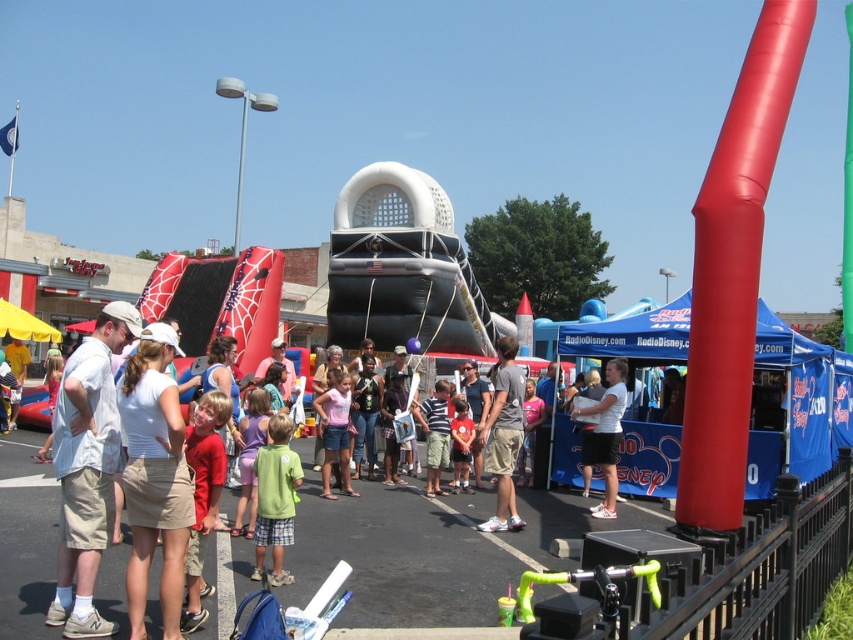
Consider the image. Is white cotton shirt at left shorter than red shirt at center?

In fact, white cotton shirt at left may be taller than red shirt at center.

Between point (90, 634) and point (473, 436), which one is positioned in front?

Positioned in front is point (90, 634).

Find the location of `white cotton shirt at left`. white cotton shirt at left is located at coordinates (86, 468).

Is green matte shirt at center positioned before red shirt at center?

Yes, it is.

Which of these two, green matte shirt at center or red shirt at center, stands taller?

green matte shirt at center

What do you see at coordinates (276, 499) in the screenshot? I see `green matte shirt at center` at bounding box center [276, 499].

Locate an element on the screen. green matte shirt at center is located at coordinates (276, 499).

Does white matte shirt at center appear on the right side of red shirt at center?

Correct, you'll find white matte shirt at center to the right of red shirt at center.

Which of these two, white matte shirt at center or red shirt at center, stands shorter?

red shirt at center

Identify the location of white matte shirt at center. The width and height of the screenshot is (853, 640). (605, 435).

Find the location of a particular element. white matte shirt at center is located at coordinates (605, 435).